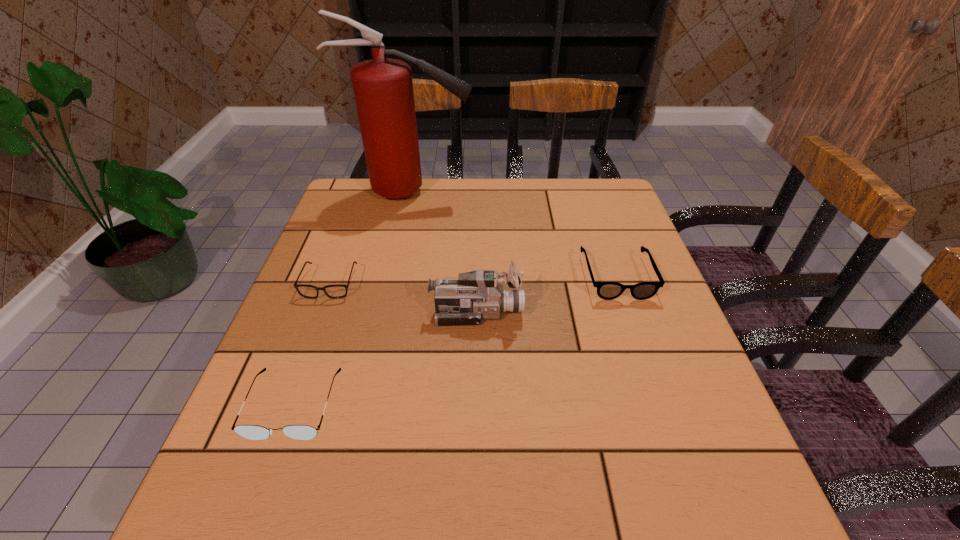
Locate an element on the screen. unoccupied position between the rightmost spectacles and the fourth shortest object is located at coordinates (546, 294).

Identify which object is the second closest to the nearest object. Please provide its 2D coordinates. Your answer should be formatted as a tuple, i.e. [(x, y)], where the tuple contains the x and y coordinates of a point satisfying the conditions above.

[(337, 291)]

At what (x,y) coordinates should I click in order to perform the action: click on object that is the third closest to the shortest object. Please return your answer as a coordinate pair (x, y). Image resolution: width=960 pixels, height=540 pixels. Looking at the image, I should click on (383, 88).

Identify the location of spectacles that can be found as the closest to the shortest spectacles. (253, 432).

Where is `spectacles object that ranks as the second closest to the rightmost spectacles`? The height and width of the screenshot is (540, 960). spectacles object that ranks as the second closest to the rightmost spectacles is located at coordinates (253, 432).

I want to click on free location that satisfies the following two spatial constraints: 1. at the nozzle of the farthest object; 2. on the lenses of the nearest spectacles, so (x=365, y=404).

The image size is (960, 540). In order to click on free location that satisfies the following two spatial constraints: 1. on the front-facing side of the camcorder; 2. on the lenses of the nearest object in this screenshot , I will do click(x=476, y=404).

Image resolution: width=960 pixels, height=540 pixels. I want to click on free space that satisfies the following two spatial constraints: 1. on the front-facing side of the camcorder; 2. on the lenses of the nearest spectacles, so click(476, 404).